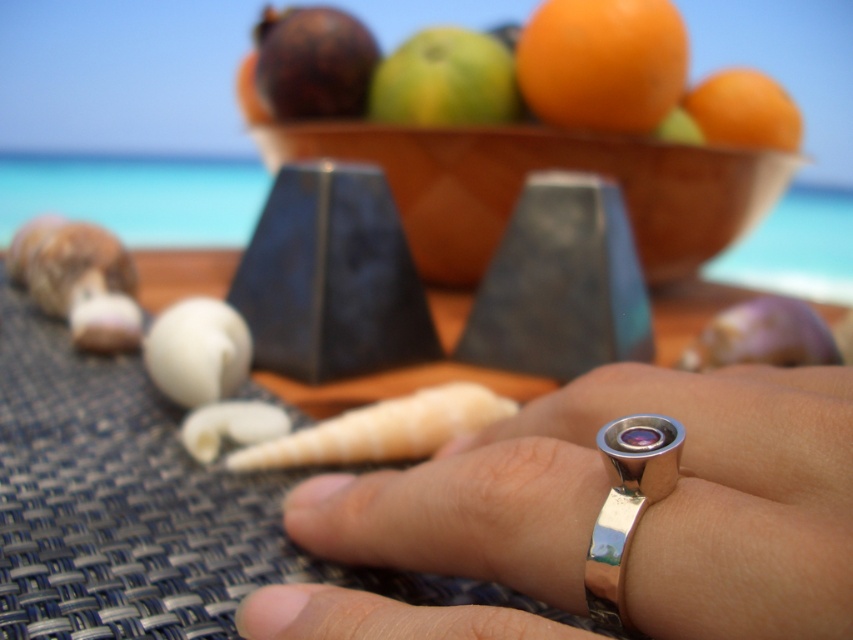
From the picture: You are standing at the origin point in the image. There is a point marked at coordinates (445, 81). What object is located at that point?

The point at coordinates (445, 81) corresponds to the green matte apple at upper center.

You are a beach vendor who wants to sell the orangesmoothfruit at upper center and orangesmoothfruit at right. Which one should you price higher based on their sizes?

The orangesmoothfruit at right should be priced higher because it has a larger size compared to the orangesmoothfruit at upper center.